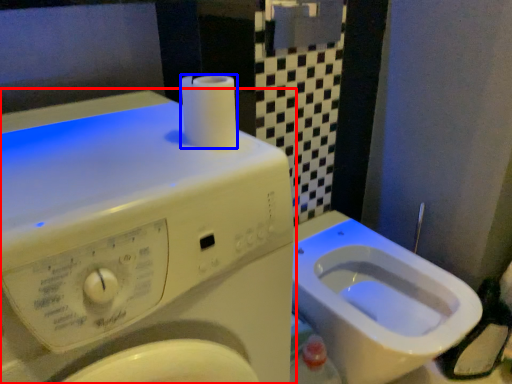
Question: Which point is closer to the camera, washing machine (highlighted by a red box) or toilet paper (highlighted by a blue box)?

Choices:
 (A) washing machine
 (B) toilet paper

Answer: (A)